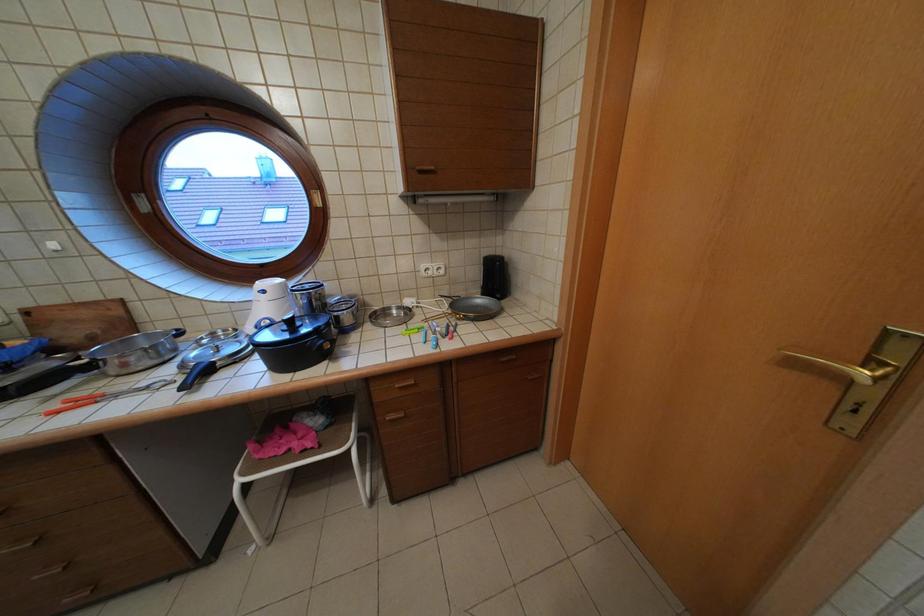
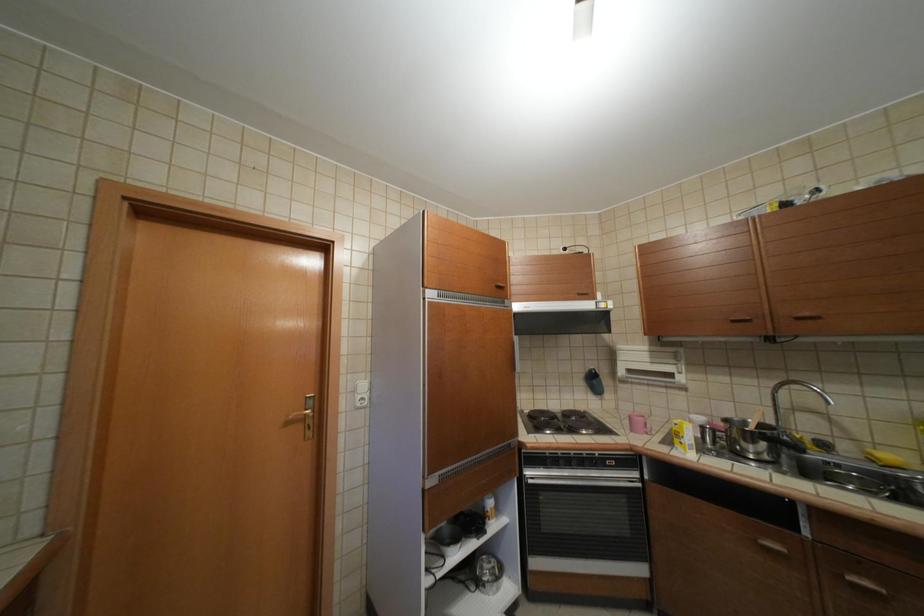
Question: Based on the continuous images, in which direction is the camera rotating? Reply with the corresponding letter.

Choices:
 (A) Left
 (B) Right
 (C) Up
 (D) Down

Answer: (B)